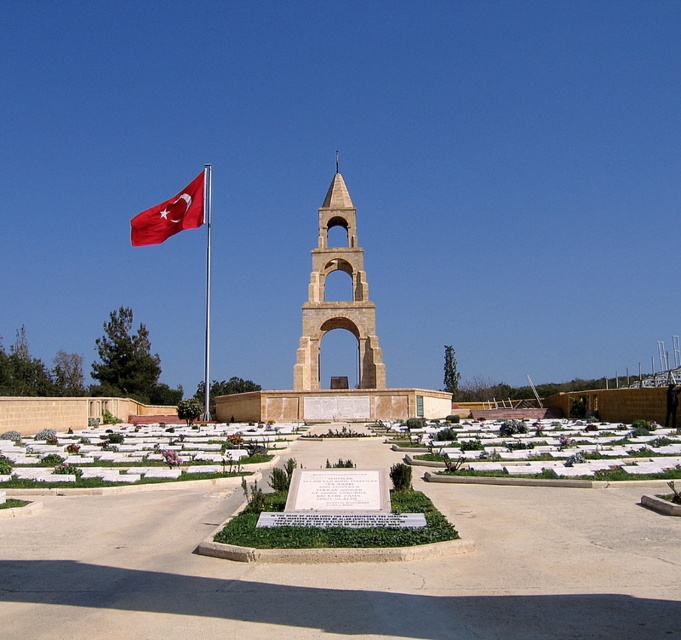
You are a visitor at the memorial site and notice the red fabric flag at left and the metallic flag pole at left. Which object is closer to you?

The red fabric flag at left is positioned over the metallic flag pole at left, so the red fabric flag at left is closer to you.

You are a visitor at the memorial site and want to take a photo of both the beige stone bell tower at center and the red fabric flag at left. Which object should you focus on first if you want to ensure both are in the frame?

You should focus on the beige stone bell tower at center first because it is taller than the red fabric flag at left, so you need to position your camera to include its full height while still capturing the flag in the frame.

You are a visitor at the memorial site and want to take a photo of the red fabric flag at left and the metallic flag pole at left. Which object should you focus on first if you want to capture both in the frame without moving the camera?

You should focus on the metallic flag pole at left first because it is larger than the red fabric flag at left, ensuring it fits better in the frame while the smaller flag can be included without needing to adjust the camera position.